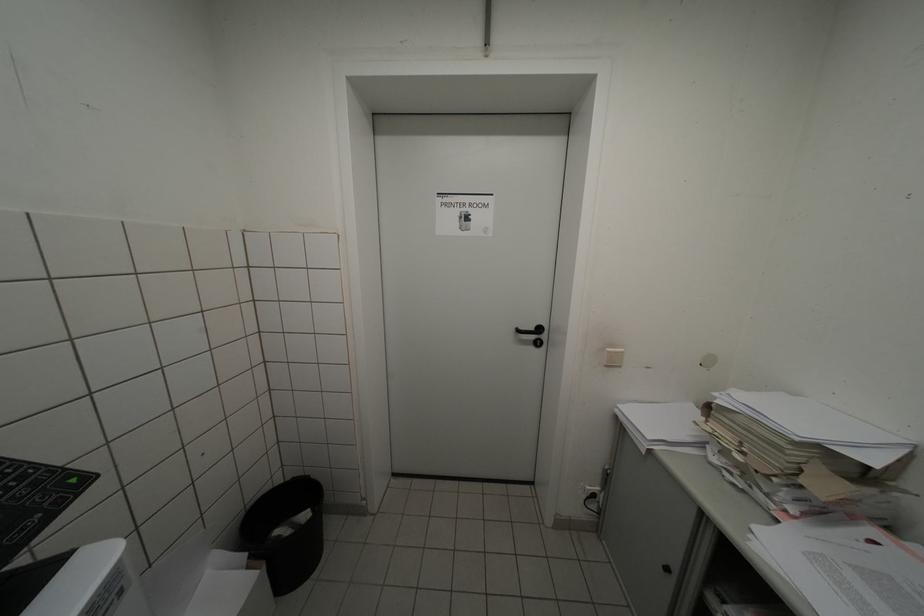
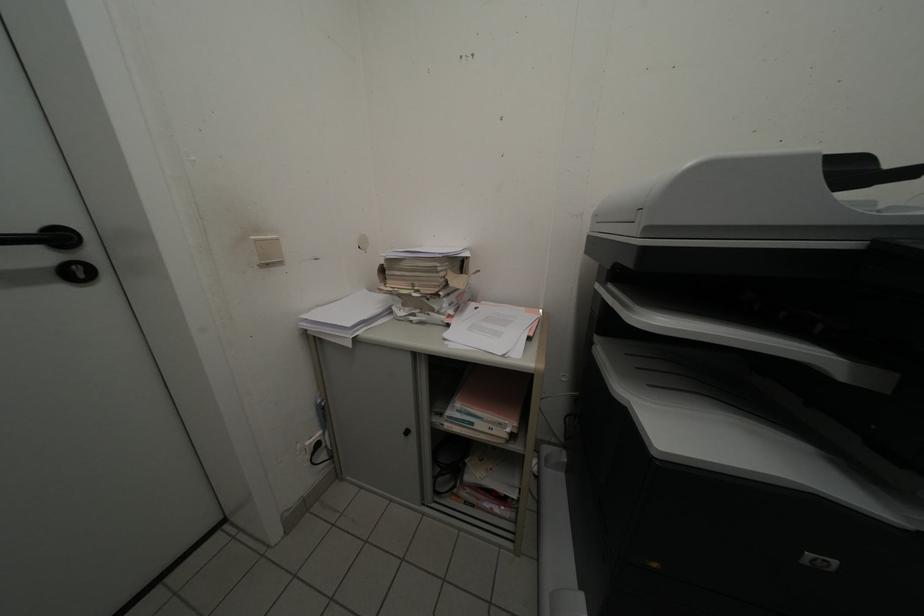
The images are taken continuously from a first-person perspective. In which direction is your viewpoint rotating?

The rotation direction of the camera is right-down.